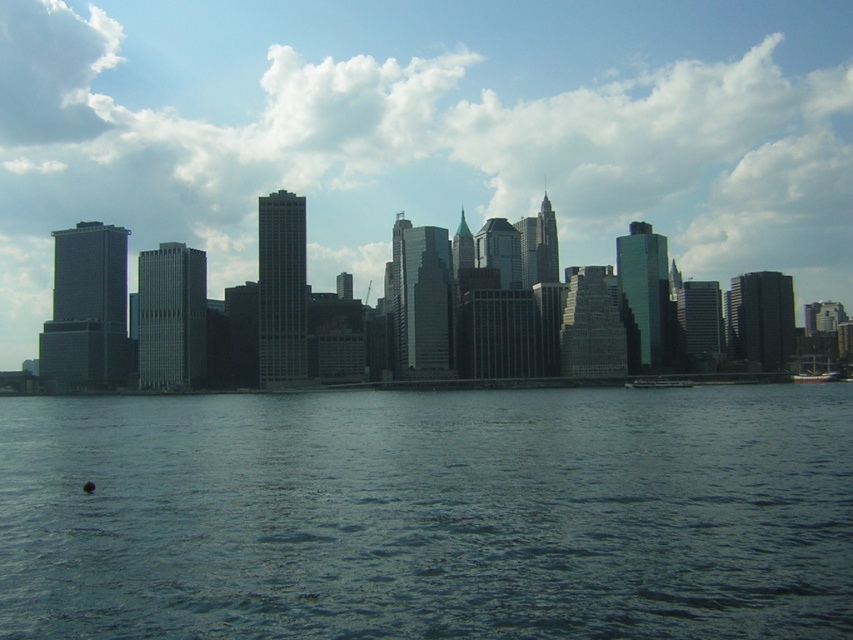
Question: Estimate the real-world distances between objects in this image. Which object is closer to the metallic silver boat at lower right?

Choices:
 (A) transparent glass skyscrapers at center
 (B) white matte boat at lower right
 (C) dark blue water at lower center

Answer: (B)

Question: Does dark blue water at lower center come behind metallic silver boat at lower right?

Choices:
 (A) no
 (B) yes

Answer: (A)

Question: Which point is closer to the camera?

Choices:
 (A) (239, 56)
 (B) (820, 371)

Answer: (B)

Question: Is transparent glass skyscrapers at center smaller than metallic silver boat at lower right?

Choices:
 (A) yes
 (B) no

Answer: (B)

Question: Which of the following is the farthest from the observer?

Choices:
 (A) (315, 604)
 (B) (141, 45)
 (C) (688, 385)

Answer: (B)

Question: Can you confirm if transparent glass skyscrapers at center is positioned below dark blue water at lower center?

Choices:
 (A) yes
 (B) no

Answer: (B)